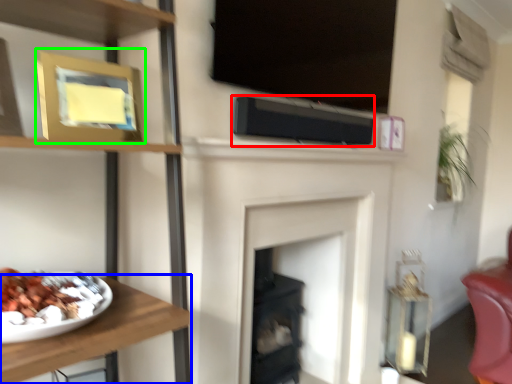
Question: Which is farther away from speaker (highlighted by a red box)? furniture (highlighted by a blue box) or picture frame (highlighted by a green box)?

Choices:
 (A) furniture
 (B) picture frame

Answer: (A)